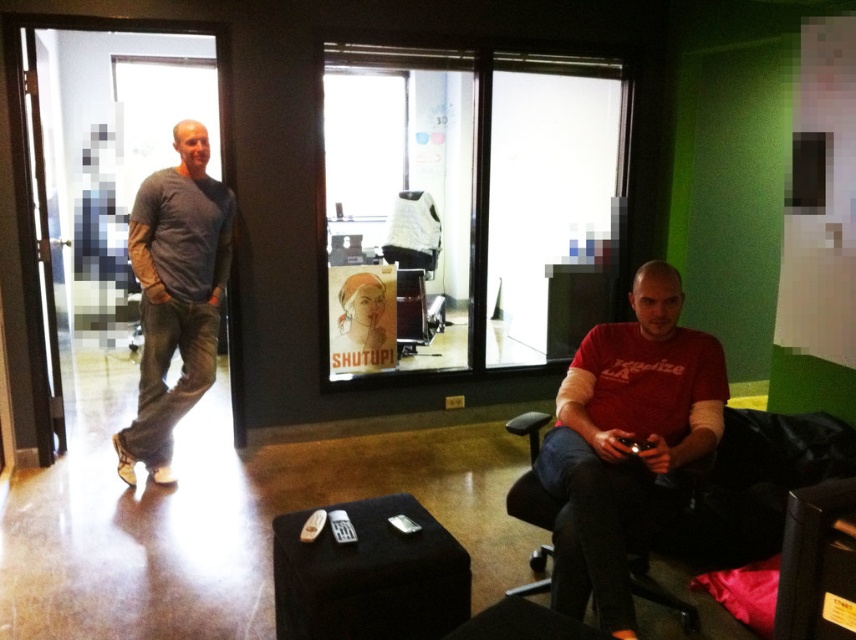
You are a delivery person carrying a box that is 1.2 meters wide. You need to place it in the room shown. Can you fit the box between the gray cotton shirt at left and the black leather armchair at right without moving any furniture?

The gray cotton shirt at left might be wider than black leather armchair at right, so the distance between them is uncertain. Without knowing the exact width of the path, it is not possible to determine if the 1.2 meter wide box can fit between them.